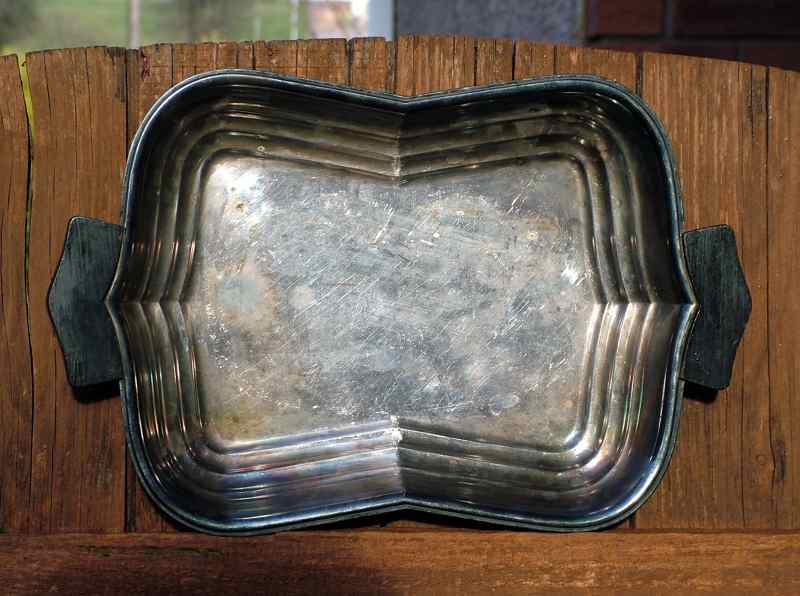
At what (x,y) coordinates should I click in order to perform the action: click on tray. Please return your answer as a coordinate pair (x, y). Looking at the image, I should click on (246, 496).